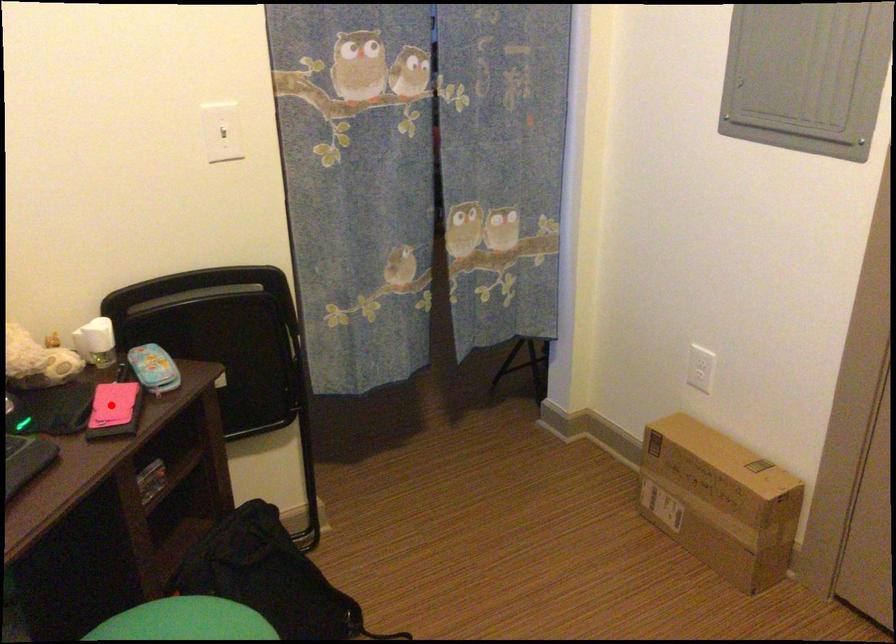
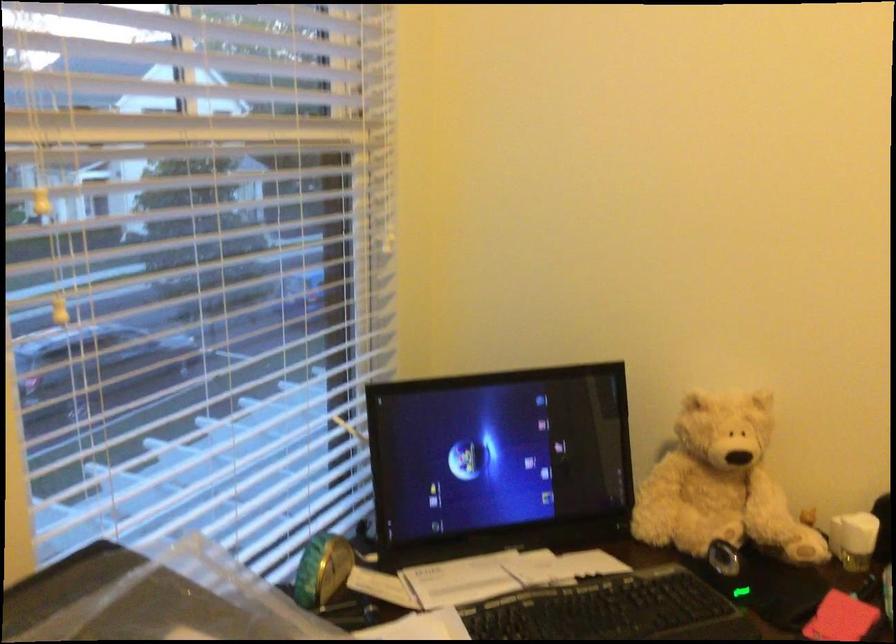
Question: I am providing you with two images of the same scene from different viewpoints. A red point is shown in image1. For the corresponding object point in image2, is it positioned nearer or farther from the camera?

Choices:
 (A) Nearer
 (B) Farther

Answer: (A)